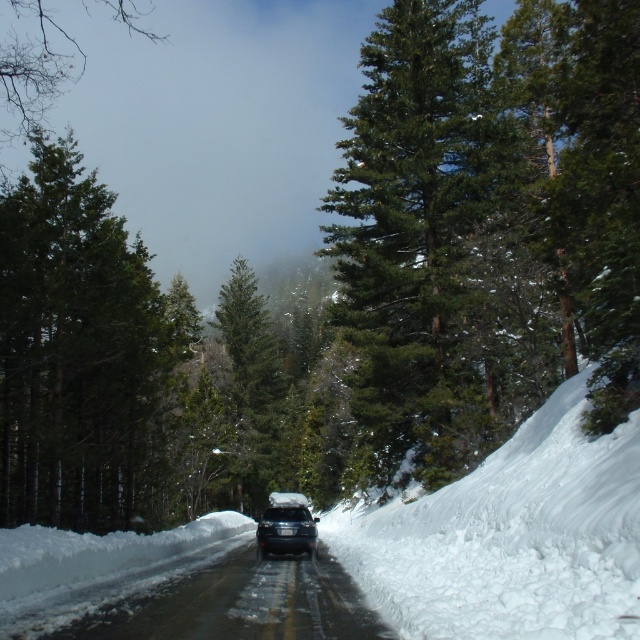
Question: Which point is farther to the camera?

Choices:
 (A) (83, 339)
 (B) (301, 515)
 (C) (412, 348)
 (D) (634, 625)

Answer: (C)

Question: Which point is farther from the camera taking this photo?

Choices:
 (A) (468, 234)
 (B) (268, 525)
 (C) (19, 465)
 (D) (44, 84)

Answer: (D)

Question: Which object appears farthest from the camera in this image?

Choices:
 (A) green textured tree at left
 (B) white fluffy snow at right
 (C) green matte tree at center
 (D) black asphalt road at center

Answer: (C)

Question: Is green textured pine tree at center closer to the viewer compared to green textured tree at left?

Choices:
 (A) no
 (B) yes

Answer: (A)

Question: Does green textured pine tree at center appear under white fluffy snow at right?

Choices:
 (A) yes
 (B) no

Answer: (B)

Question: Can you confirm if green textured pine tree at center is bigger than green textured tree at left?

Choices:
 (A) yes
 (B) no

Answer: (B)